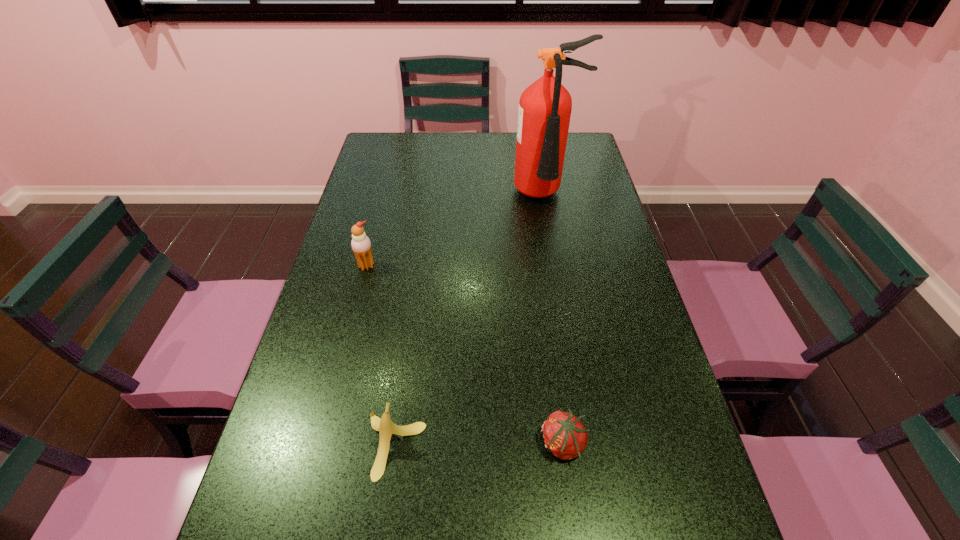
You are a GUI agent. You are given a task and a screenshot of the screen. Output one action in this format:
    pyautogui.click(x=<x>, y=<y>)
    Task: Click on the vacant space that satisfies the following two spatial constraints: 1. at the front with a straw on the second shortest object; 2. on the right side of the second tallest object
    This screenshot has width=960, height=540.
    Given the screenshot: What is the action you would take?
    pyautogui.click(x=321, y=446)

Where is `free spot that satisfies the following two spatial constraints: 1. at the front with a straw on the banana; 2. on the right side of the third shortest object`? This screenshot has height=540, width=960. free spot that satisfies the following two spatial constraints: 1. at the front with a straw on the banana; 2. on the right side of the third shortest object is located at coordinates (321, 446).

In order to click on vacant position in the image that satisfies the following two spatial constraints: 1. at the front with a straw on the shortest object; 2. on the left side of the leftmost object in this screenshot , I will do `click(322, 444)`.